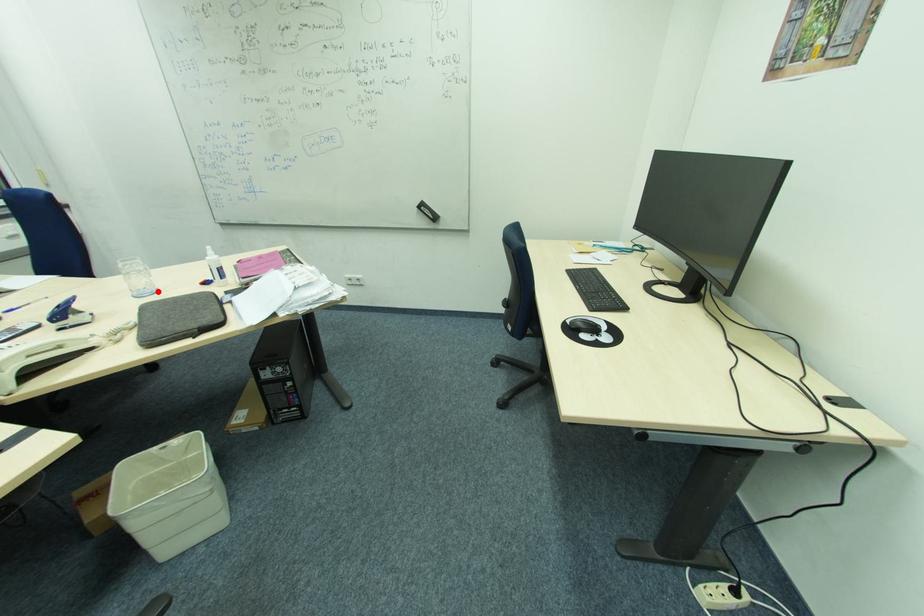
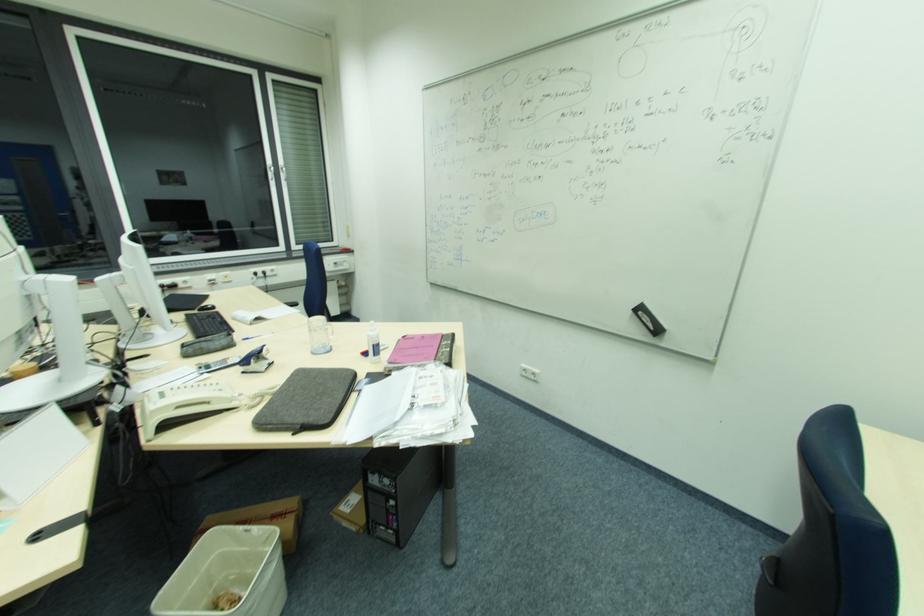
In the second image, find the point that corresponds to the highlighted location in the first image.

(330, 351)